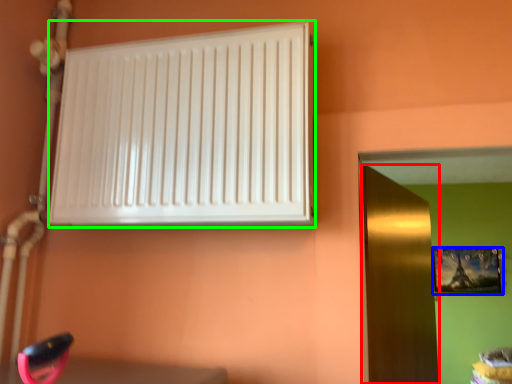
Question: Estimate the real-world distances between objects in this image. Which object is farther from door (highlighted by a red box), picture frame (highlighted by a blue box) or radiator (highlighted by a green box)?

Choices:
 (A) picture frame
 (B) radiator

Answer: (A)